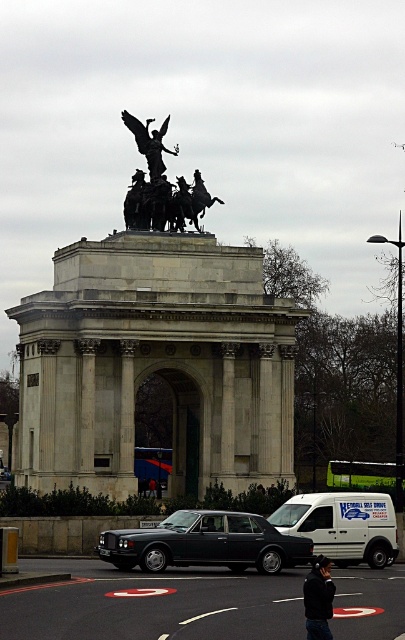
You are a tour guide explaining the monument to visitors. You point out the shiny black car at center and the polished bronze statue at upper center. Can you tell the visitors which object is located directly above the other?

The polished bronze statue at upper center is directly above the shiny black car at center, as the car is positioned under the statue.

You are a photographer wanting to capture the shiny black car at center and the black fabric jacket at lower center in one frame. Which object should you focus on first to ensure both fit in the frame?

The shiny black car at center is wider than the black fabric jacket at lower center, so you should focus on the shiny black car at center first to ensure both objects fit in the frame.